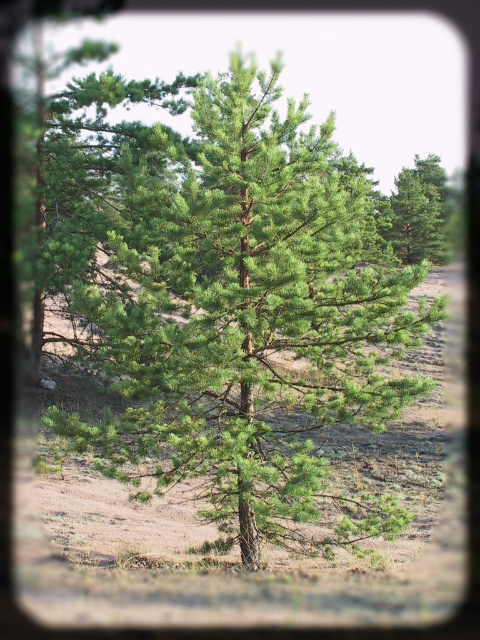
Is point (362, 211) more distant than point (427, 212)?

No, it is not.

This screenshot has width=480, height=640. I want to click on green needle-like tree at center, so click(244, 312).